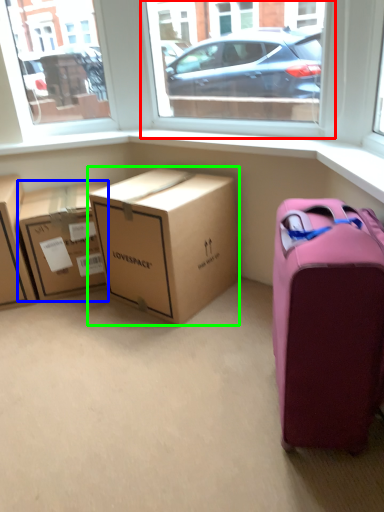
Question: Which object is positioned closest to window screen (highlighted by a red box)? Select from box (highlighted by a blue box) and box (highlighted by a green box).

Choices:
 (A) box
 (B) box

Answer: (B)